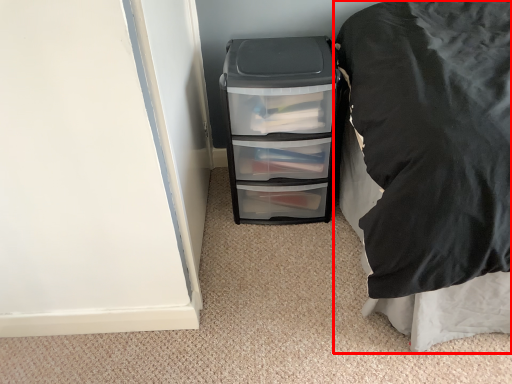
Question: Considering the relative positions of furniture (annotated by the red box) and file cabinet in the image provided, where is furniture (annotated by the red box) located with respect to the staircase?

Choices:
 (A) right
 (B) left

Answer: (A)